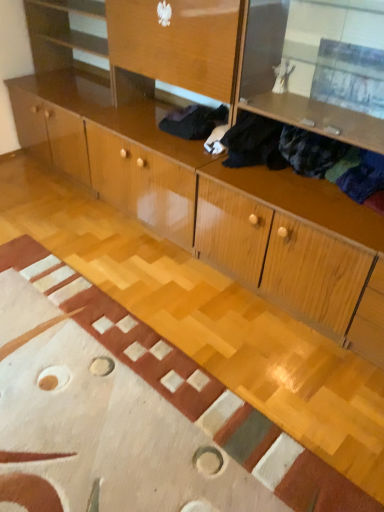
Looking at this image, measure the distance between black fabric at center, the 2th clothing viewed from the front, and camera.

They are 7.37 feet apart.

This screenshot has height=512, width=384. What do you see at coordinates (194, 121) in the screenshot? I see `black fabric at center, the 2th clothing viewed from the front` at bounding box center [194, 121].

At what (x,y) coordinates should I click in order to perform the action: click on black fabric at center, the 2th clothing viewed from the front. Please return your answer as a coordinate pair (x, y). The image size is (384, 512). Looking at the image, I should click on (194, 121).

In order to face black fabric at center, the 2th clothing viewed from the front, should I rotate leftwards or rightwards?

You should rotate right by 0.600 degrees.

This screenshot has height=512, width=384. What do you see at coordinates (280, 147) in the screenshot?
I see `dark blue fabric at upper right, positioned as the 2th clothing in back-to-front order` at bounding box center [280, 147].

How much space does dark blue fabric at upper right, positioned as the 2th clothing in back-to-front order, occupy horizontally?

The width of dark blue fabric at upper right, positioned as the 2th clothing in back-to-front order, is 13.49 inches.

The width and height of the screenshot is (384, 512). Identify the location of dark blue fabric at upper right, positioned as the 1th clothing in front-to-back order. (280, 147).

Identify the location of black fabric at center, the first clothing positioned from the back. (194, 121).

Is black fabric at center, the first clothing positioned from the back, to the right of dark blue fabric at upper right, positioned as the 1th clothing in front-to-back order, from the viewer's perspective?

Incorrect, black fabric at center, the first clothing positioned from the back, is not on the right side of dark blue fabric at upper right, positioned as the 1th clothing in front-to-back order.

Is the position of black fabric at center, the 2th clothing viewed from the front, more distant than that of dark blue fabric at upper right, positioned as the 2th clothing in back-to-front order?

Yes, black fabric at center, the 2th clothing viewed from the front, is further from the camera.

Is point (196, 123) closer to camera compared to point (357, 168)?

No, it is behind (357, 168).

From the image's perspective, is black fabric at center, the 2th clothing viewed from the front, on dark blue fabric at upper right, positioned as the 1th clothing in front-to-back order?

Yes, from the image's perspective, black fabric at center, the 2th clothing viewed from the front, is above dark blue fabric at upper right, positioned as the 1th clothing in front-to-back order.

From a real-world perspective, is black fabric at center, the first clothing positioned from the back, positioned above or below dark blue fabric at upper right, positioned as the 1th clothing in front-to-back order?

Clearly, from a real-world perspective, black fabric at center, the first clothing positioned from the back, is below dark blue fabric at upper right, positioned as the 1th clothing in front-to-back order.

Considering the sizes of black fabric at center, the 2th clothing viewed from the front, and dark blue fabric at upper right, positioned as the 1th clothing in front-to-back order, in the image, is black fabric at center, the 2th clothing viewed from the front, wider or thinner than dark blue fabric at upper right, positioned as the 1th clothing in front-to-back order,?

black fabric at center, the 2th clothing viewed from the front, is wider than dark blue fabric at upper right, positioned as the 1th clothing in front-to-back order.

In the scene shown: Is black fabric at center, the first clothing positioned from the back, taller or shorter than dark blue fabric at upper right, positioned as the 1th clothing in front-to-back order?

Considering their sizes, black fabric at center, the first clothing positioned from the back, has less height than dark blue fabric at upper right, positioned as the 1th clothing in front-to-back order.

Is black fabric at center, the first clothing positioned from the back, bigger or smaller than dark blue fabric at upper right, positioned as the 2th clothing in back-to-front order?

Clearly, black fabric at center, the first clothing positioned from the back, is smaller in size than dark blue fabric at upper right, positioned as the 2th clothing in back-to-front order.

Would you say dark blue fabric at upper right, positioned as the 2th clothing in back-to-front order, is part of black fabric at center, the 2th clothing viewed from the front,'s contents?

Definitely not — dark blue fabric at upper right, positioned as the 2th clothing in back-to-front order, is not inside black fabric at center, the 2th clothing viewed from the front.

Is black fabric at center, the first clothing positioned from the back, directly adjacent to dark blue fabric at upper right, positioned as the 2th clothing in back-to-front order?

black fabric at center, the first clothing positioned from the back, and dark blue fabric at upper right, positioned as the 2th clothing in back-to-front order, are not in contact.

In the scene shown: Is dark blue fabric at upper right, positioned as the 1th clothing in front-to-back order, at the back of black fabric at center, the 2th clothing viewed from the front?

No, black fabric at center, the 2th clothing viewed from the front, is not facing away from dark blue fabric at upper right, positioned as the 1th clothing in front-to-back order.

Where is `clothing that appears above the black fabric at center, the first clothing positioned from the back (from a real-world perspective)`? The height and width of the screenshot is (512, 384). clothing that appears above the black fabric at center, the first clothing positioned from the back (from a real-world perspective) is located at coordinates (280, 147).

Can you confirm if dark blue fabric at upper right, positioned as the 2th clothing in back-to-front order, is positioned to the left of black fabric at center, the first clothing positioned from the back?

In fact, dark blue fabric at upper right, positioned as the 2th clothing in back-to-front order, is to the right of black fabric at center, the first clothing positioned from the back.

Is dark blue fabric at upper right, positioned as the 1th clothing in front-to-back order, closer to camera compared to black fabric at center, the first clothing positioned from the back?

Yes, it is.

Which is in front, point (239, 153) or point (180, 123)?

The point (239, 153) is more forward.

From the image's perspective, is dark blue fabric at upper right, positioned as the 1th clothing in front-to-back order, beneath black fabric at center, the 2th clothing viewed from the front?

Indeed, from the image's perspective, dark blue fabric at upper right, positioned as the 1th clothing in front-to-back order, is shown beneath black fabric at center, the 2th clothing viewed from the front.

From a real-world perspective, is dark blue fabric at upper right, positioned as the 2th clothing in back-to-front order, on top of black fabric at center, the 2th clothing viewed from the front?

Indeed, from a real-world perspective, dark blue fabric at upper right, positioned as the 2th clothing in back-to-front order, stands above black fabric at center, the 2th clothing viewed from the front.

Does dark blue fabric at upper right, positioned as the 2th clothing in back-to-front order, have a lesser width compared to black fabric at center, the first clothing positioned from the back?

Indeed, dark blue fabric at upper right, positioned as the 2th clothing in back-to-front order, has a lesser width compared to black fabric at center, the first clothing positioned from the back.

Is dark blue fabric at upper right, positioned as the 1th clothing in front-to-back order, shorter than black fabric at center, the first clothing positioned from the back?

No.

Considering the relative sizes of dark blue fabric at upper right, positioned as the 2th clothing in back-to-front order, and black fabric at center, the first clothing positioned from the back, in the image provided, is dark blue fabric at upper right, positioned as the 2th clothing in back-to-front order, smaller than black fabric at center, the first clothing positioned from the back,?

Actually, dark blue fabric at upper right, positioned as the 2th clothing in back-to-front order, might be larger than black fabric at center, the first clothing positioned from the back.

Is black fabric at center, the first clothing positioned from the back, completely or partially inside dark blue fabric at upper right, positioned as the 2th clothing in back-to-front order?

No, dark blue fabric at upper right, positioned as the 2th clothing in back-to-front order, does not contain black fabric at center, the first clothing positioned from the back.

Looking at this image, can you see dark blue fabric at upper right, positioned as the 2th clothing in back-to-front order, touching black fabric at center, the first clothing positioned from the back?

No.

Is dark blue fabric at upper right, positioned as the 1th clothing in front-to-back order, positioned with its back to black fabric at center, the first clothing positioned from the back?

Answer: dark blue fabric at upper right, positioned as the 1th clothing in front-to-back order, does not have its back to black fabric at center, the first clothing positioned from the back.

How much distance is there between dark blue fabric at upper right, positioned as the 1th clothing in front-to-back order, and black fabric at center, the first clothing positioned from the back?

A distance of 17.97 inches exists between dark blue fabric at upper right, positioned as the 1th clothing in front-to-back order, and black fabric at center, the first clothing positioned from the back.

The height and width of the screenshot is (512, 384). I want to click on clothing above the dark blue fabric at upper right, positioned as the 2th clothing in back-to-front order (from the image's perspective), so click(x=194, y=121).

You are a GUI agent. You are given a task and a screenshot of the screen. Output one action in this format:
    pyautogui.click(x=<x>, y=<y>)
    Task: Click on the clothing below the black fabric at center, the first clothing positioned from the back (from the image's perspective)
    Image resolution: width=384 pixels, height=512 pixels.
    Given the screenshot: What is the action you would take?
    pos(280,147)

Locate an element on the screen. clothing that appears in front of the black fabric at center, the 2th clothing viewed from the front is located at coordinates (280, 147).